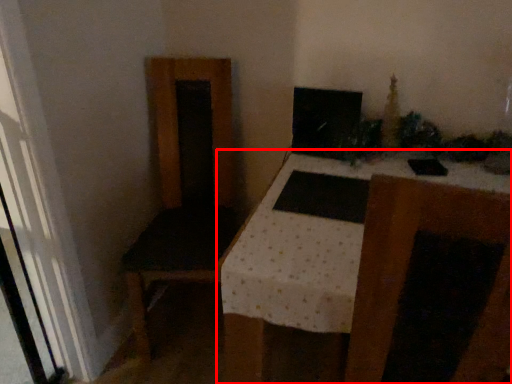
Question: Observing the image, what is the correct spatial positioning of table (annotated by the red box) in reference to computer monitor?

Choices:
 (A) left
 (B) right

Answer: (B)